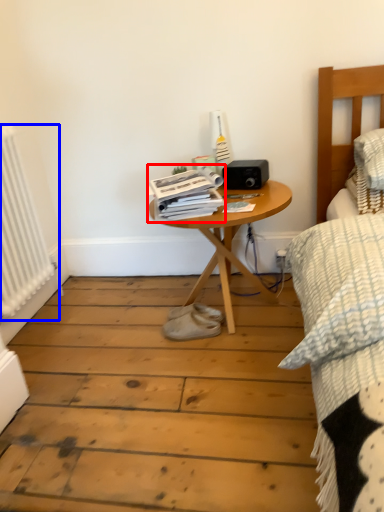
Question: Which object is further to the camera taking this photo, magazine (highlighted by a red box) or radiator (highlighted by a blue box)?

Choices:
 (A) magazine
 (B) radiator

Answer: (A)